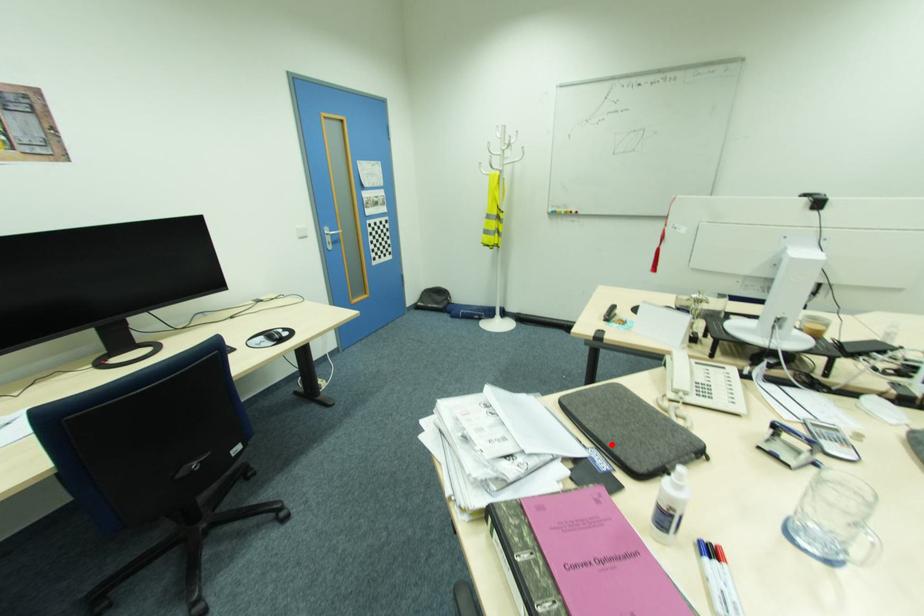
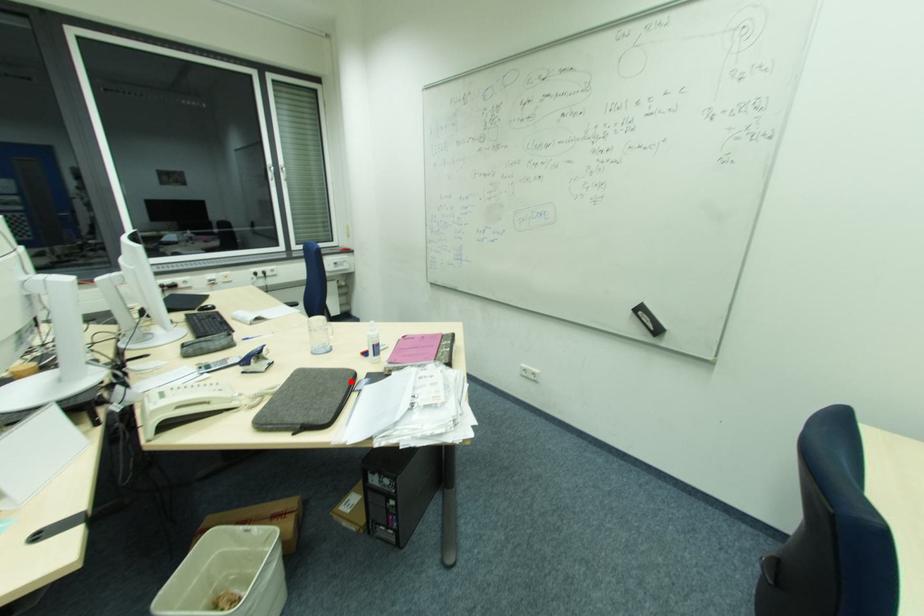
I am providing you with two images of the same scene from different viewpoints. A red point is marked on the first image and another point is marked on the second image. Are the points marked in image1 and image2 representing the same 3D position?

Yes